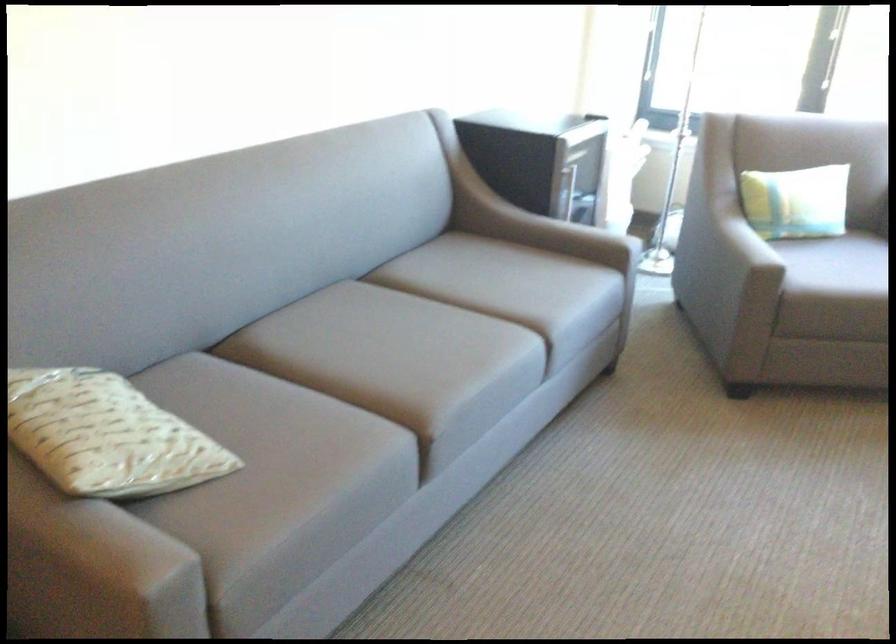
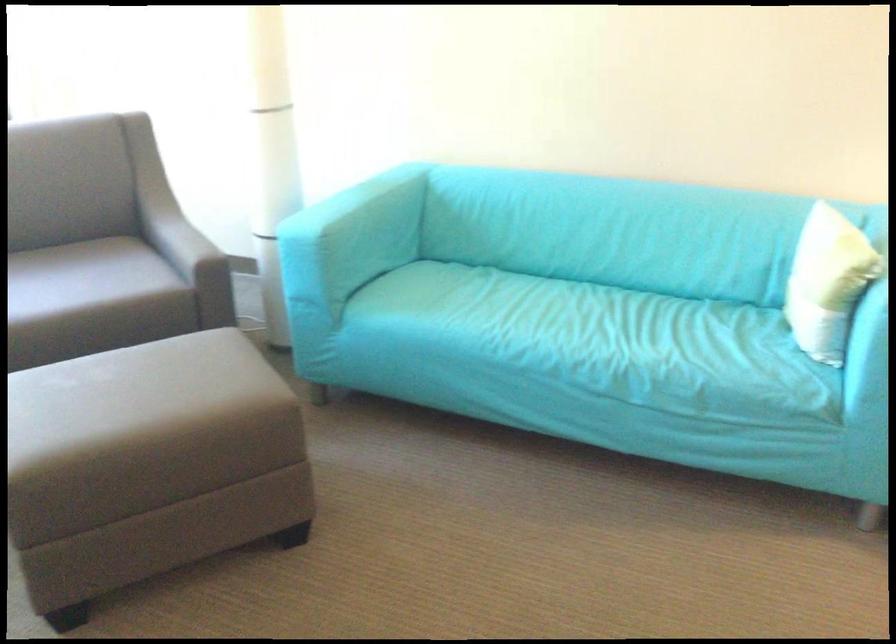
The first image is from the beginning of the video and the second image is from the end. How did the camera likely rotate when shooting the video?

The rotation direction of the camera is right-down.